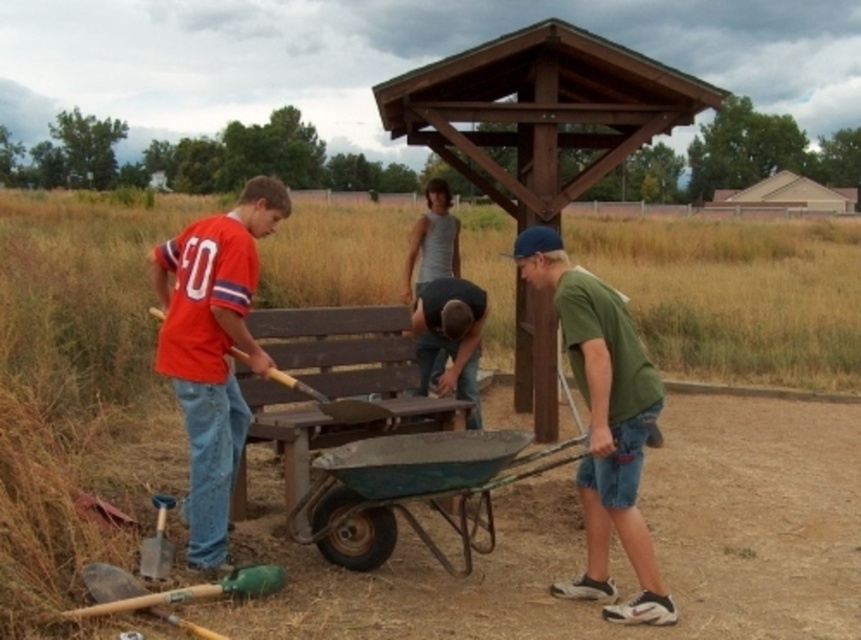
Question: Which point is farther to the camera?

Choices:
 (A) green matte shirt at lower right
 (B) wooden shovel at center
 (C) gray tank top at center

Answer: (C)

Question: Which point is farther to the camera?

Choices:
 (A) brown dry grass at center
 (B) wooden shovel at center

Answer: (B)

Question: Does matte red shirt at left appear on the left side of wooden shovel at center?

Choices:
 (A) no
 (B) yes

Answer: (B)

Question: Among these objects, which one is nearest to the camera?

Choices:
 (A) brown dry grass at center
 (B) green matte shirt at lower right

Answer: (A)

Question: From the image, what is the correct spatial relationship of matte red shirt at left in relation to green matte shirt at lower right?

Choices:
 (A) right
 (B) left

Answer: (B)

Question: Does green matte shirt at lower right appear on the right side of wooden shovel at center?

Choices:
 (A) no
 (B) yes

Answer: (B)